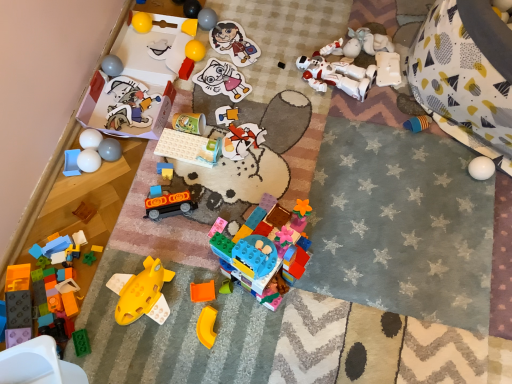
I want to click on vacant space positioned to the left of orange matte toy airplane at center, which is the eighth toy from right to left, so click(x=162, y=298).